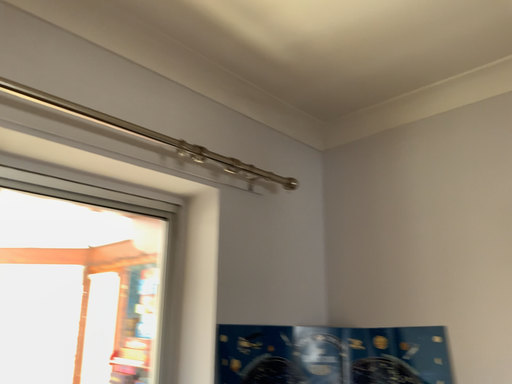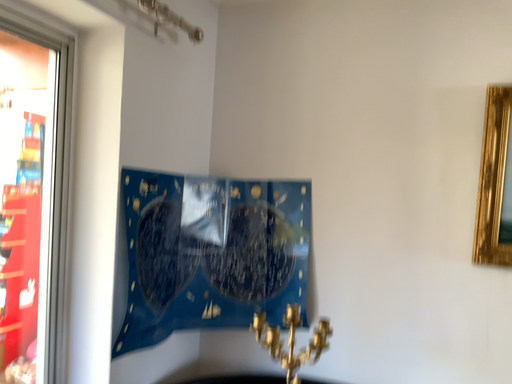
Question: How did the camera likely rotate when shooting the video?

Choices:
 (A) rotated left
 (B) rotated right

Answer: (B)